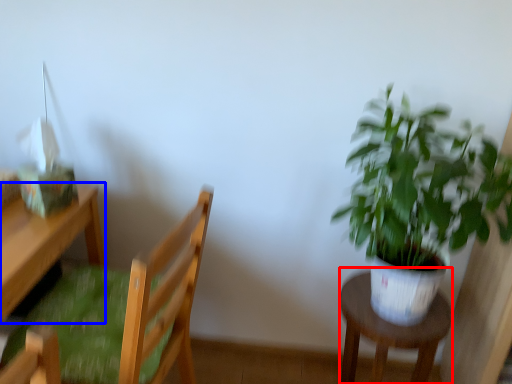
Question: Which of the following is the closest to the observer, stool (highlighted by a red box) or desk (highlighted by a blue box)?

Choices:
 (A) stool
 (B) desk

Answer: (B)